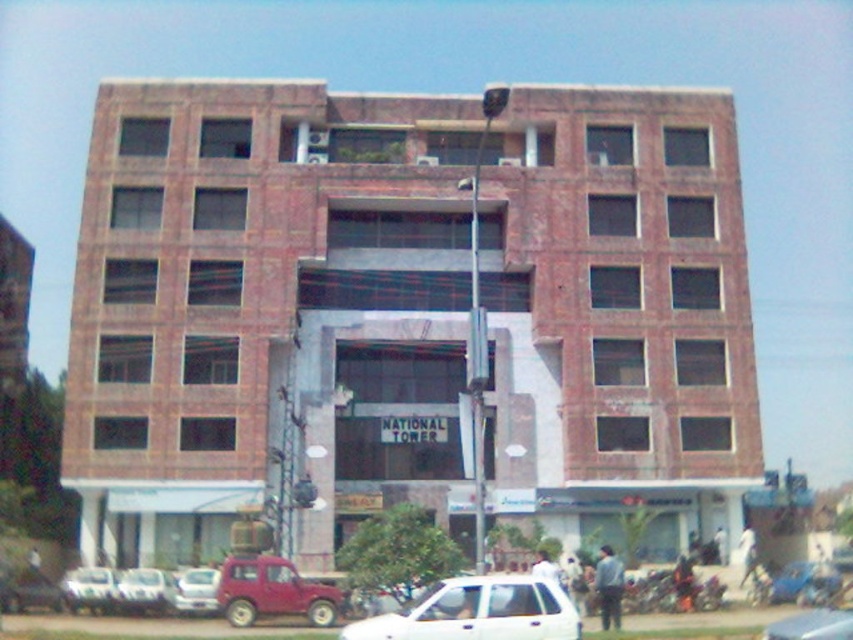
From the picture: You are standing at the entrance of the NATIONAL TOWER building and want to take a photo of the building without any vehicles in the frame. Given the white matte car at lower center is blocking the view, what is the best direction to move to avoid it?

Since the white matte car at lower center is located at coordinates approximately 0.956 on the x and 0.560 on the y axis, moving to the left or right along the building would provide a clearer view without the obstruction of the car.

You are standing at the construction site of the NATIONAL TOWER. You need to reach a specific point marked at coordinates point (851,627). If your current distance from the camera is 30 meters, can you reach the point without moving closer than 30 meters?

The distance of point (851,627) from camera is 35.59 meters, so yes, you can reach the point without moving closer than 30 meters because the point is farther away from the camera at 35.59 meters.